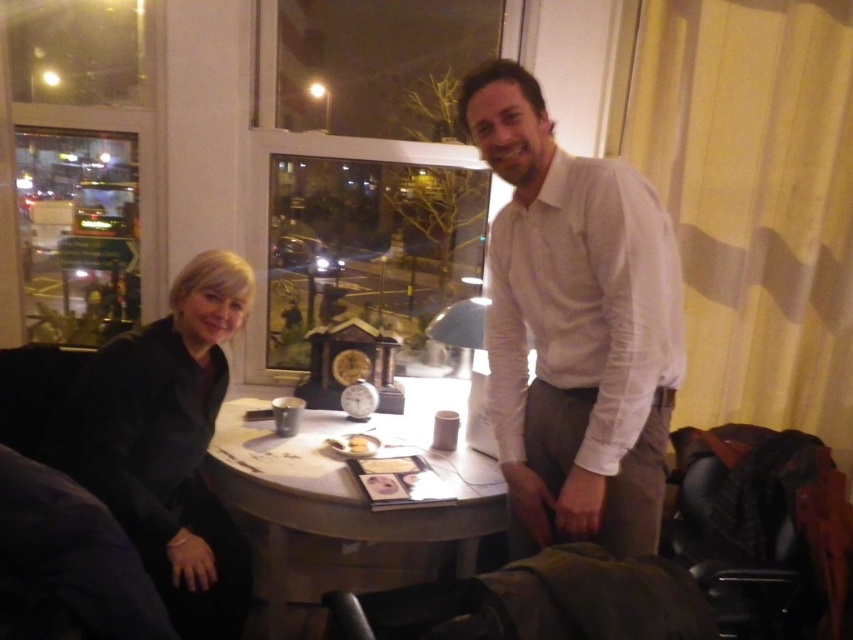
Which is behind, point (602, 195) or point (367, 637)?

Positioned behind is point (367, 637).

Who is shorter, white cotton shirt at center or brown leather bag at lower center?

Standing shorter between the two is brown leather bag at lower center.

Which is in front, point (650, 538) or point (624, 570)?

Point (624, 570) is more forward.

Locate an element on the screen. This screenshot has width=853, height=640. white cotton shirt at center is located at coordinates (573, 326).

The image size is (853, 640). I want to click on black matte jacket at lower left, so click(x=169, y=444).

Does black matte jacket at lower left have a greater width compared to white wood round table at center?

In fact, black matte jacket at lower left might be narrower than white wood round table at center.

This screenshot has height=640, width=853. Describe the element at coordinates (169, 444) in the screenshot. I see `black matte jacket at lower left` at that location.

Where is `black matte jacket at lower left`? The width and height of the screenshot is (853, 640). black matte jacket at lower left is located at coordinates (169, 444).

Between black matte jacket at lower left and brown leather bag at lower center, which one has less height?

brown leather bag at lower center is shorter.

Can you confirm if black matte jacket at lower left is positioned above brown leather bag at lower center?

Correct, black matte jacket at lower left is located above brown leather bag at lower center.

Who is more forward, (169,483) or (618,612)?

Point (618,612) is in front.

At what (x,y) coordinates should I click in order to perform the action: click on black matte jacket at lower left. Please return your answer as a coordinate pair (x, y). This screenshot has width=853, height=640. Looking at the image, I should click on (169, 444).